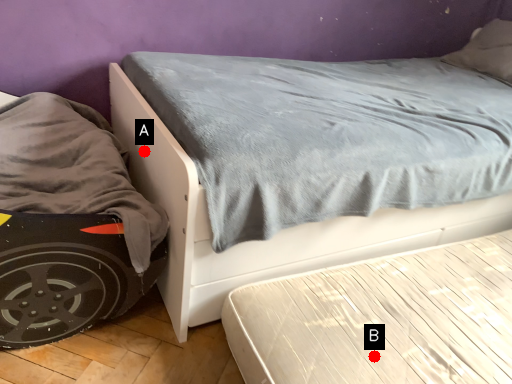
Question: Two points are circled on the image, labeled by A and B beside each circle. Which point appears farthest from the camera in this image?

Choices:
 (A) A is further
 (B) B is further

Answer: (A)